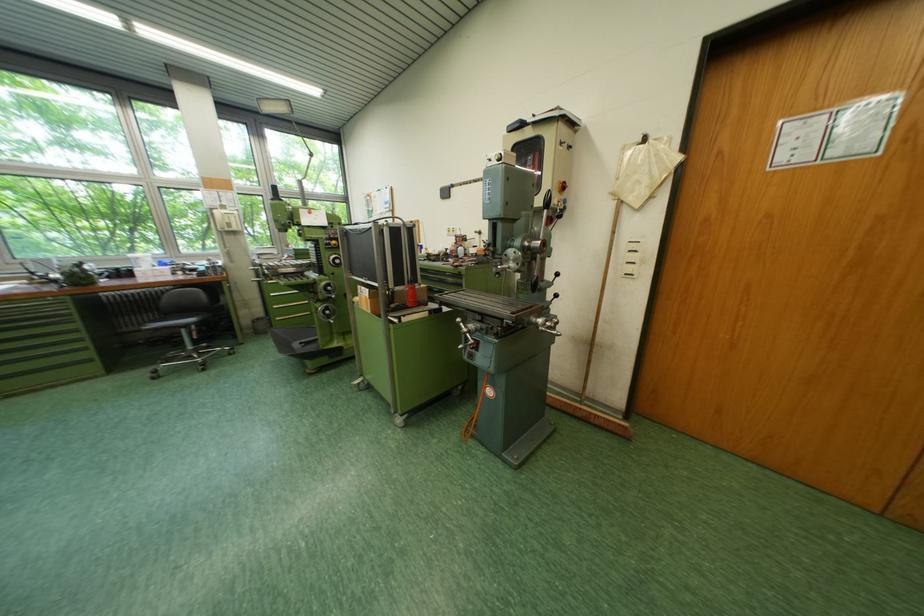
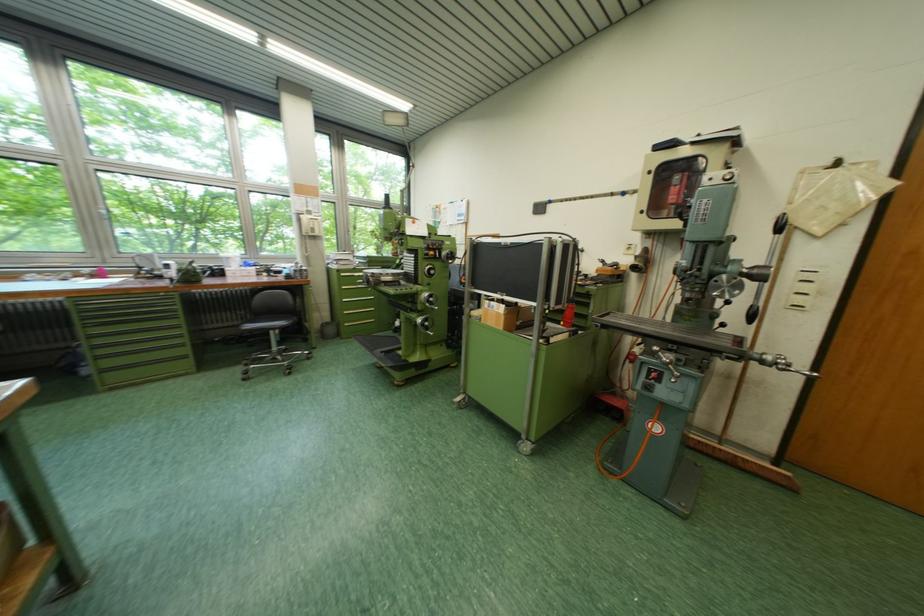
The point at (372,290) is marked in the first image. Where is the corresponding point in the second image?

(503, 305)